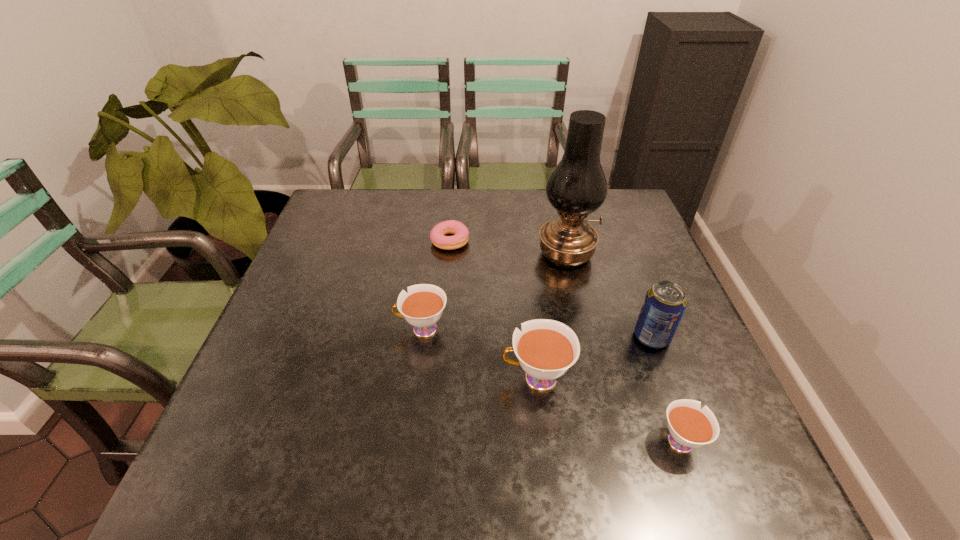
Image resolution: width=960 pixels, height=540 pixels. Identify the location of free space located on the left of the fifth shortest object. (560, 337).

Locate an element on the screen. The image size is (960, 540). object positioned at the far edge is located at coordinates (460, 238).

At what (x,y) coordinates should I click in order to perform the action: click on teacup that is at the right edge. Please return your answer as a coordinate pair (x, y). The width and height of the screenshot is (960, 540). Looking at the image, I should click on click(x=690, y=426).

Where is `soda located in the right edge section of the desktop`? The image size is (960, 540). soda located in the right edge section of the desktop is located at coordinates (665, 303).

I want to click on object located at the near right corner, so [x=690, y=426].

In the image, there is a desktop. Where is `vacant space at the far edge`? This screenshot has width=960, height=540. vacant space at the far edge is located at coordinates (534, 196).

Image resolution: width=960 pixels, height=540 pixels. Identify the location of free space at the near edge. (479, 408).

Find the location of `blank space at the right edge`. blank space at the right edge is located at coordinates (616, 278).

The image size is (960, 540). I want to click on vacant area at the far left corner, so pos(334,214).

The height and width of the screenshot is (540, 960). I want to click on vacant region at the far right corner of the desktop, so click(613, 195).